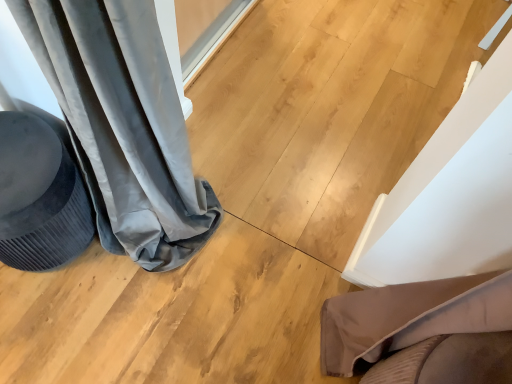
Identify the location of free space in front of velvet dark gray swivel chair at left. The image size is (512, 384). (47, 327).